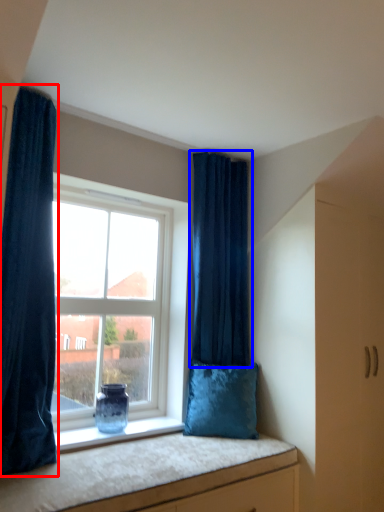
Question: Among these objects, which one is nearest to the camera, curtain (highlighted by a red box) or curtain (highlighted by a blue box)?

Choices:
 (A) curtain
 (B) curtain

Answer: (A)